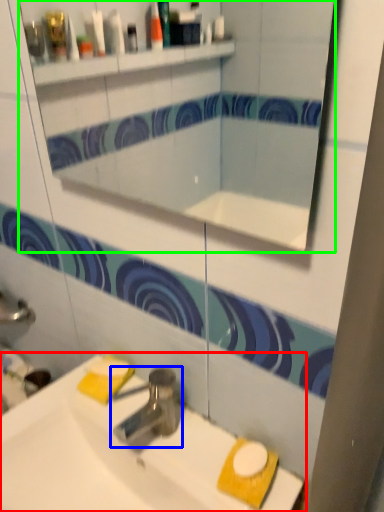
Question: Which object is positioned farthest from sink (highlighted by a red box)? Select from tap (highlighted by a blue box) and mirror (highlighted by a green box).

Choices:
 (A) tap
 (B) mirror

Answer: (B)